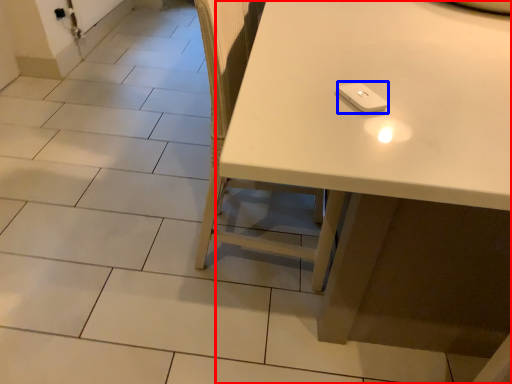
Question: Which object appears closest to the camera in this image, table (highlighted by a red box) or Wii controller (highlighted by a blue box)?

Choices:
 (A) table
 (B) Wii controller

Answer: (A)